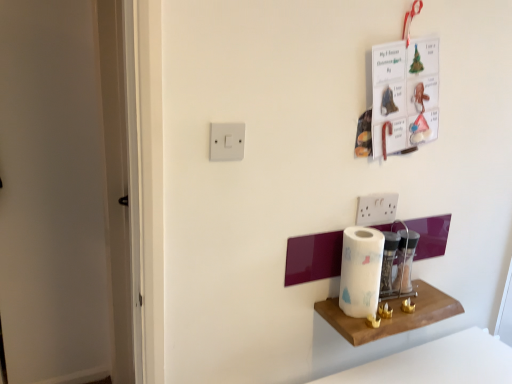
Question: Considering the relative sizes of wooden shelf at lower right and white paper at center in the image provided, is wooden shelf at lower right taller than white paper at center?

Choices:
 (A) yes
 (B) no

Answer: (B)

Question: Considering the relative sizes of wooden shelf at lower right and white paper at center in the image provided, is wooden shelf at lower right shorter than white paper at center?

Choices:
 (A) no
 (B) yes

Answer: (B)

Question: From a real-world perspective, does wooden shelf at lower right stand above white paper at center?

Choices:
 (A) yes
 (B) no

Answer: (B)

Question: Is wooden shelf at lower right further to the viewer compared to white paper at center?

Choices:
 (A) yes
 (B) no

Answer: (B)

Question: Is wooden shelf at lower right next to white paper at center?

Choices:
 (A) yes
 (B) no

Answer: (B)

Question: Is wooden shelf at lower right positioned with its back to white paper at center?

Choices:
 (A) yes
 (B) no

Answer: (B)

Question: From a real-world perspective, is white paper at center positioned under white plastic light switch at upper center based on gravity?

Choices:
 (A) no
 (B) yes

Answer: (B)

Question: Is white paper at center at the left side of white plastic light switch at upper center?

Choices:
 (A) yes
 (B) no

Answer: (B)

Question: Is white paper at center not within white plastic light switch at upper center?

Choices:
 (A) no
 (B) yes

Answer: (B)

Question: Is white paper at center bigger than white plastic light switch at upper center?

Choices:
 (A) yes
 (B) no

Answer: (A)

Question: From the image's perspective, is white paper at center over white plastic light switch at upper center?

Choices:
 (A) no
 (B) yes

Answer: (A)

Question: From the image's perspective, is white paper at center below white plastic light switch at upper center?

Choices:
 (A) yes
 (B) no

Answer: (A)

Question: From a real-world perspective, is white plastic light switch at upper center located higher than white paper at center?

Choices:
 (A) no
 (B) yes

Answer: (B)